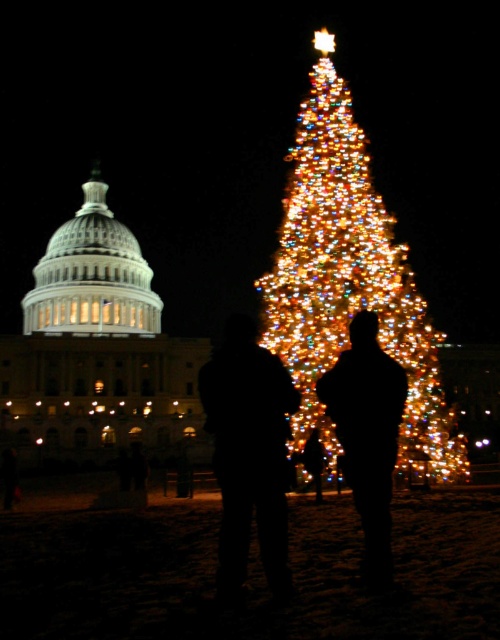
Question: Can you confirm if illuminated glass christmas tree at center is smaller than black silhouette couple at center?

Choices:
 (A) yes
 (B) no

Answer: (B)

Question: Which object is the closest to the black silhouette couple at center?

Choices:
 (A) black matte figure at center
 (B) illuminated glass christmas tree at center
 (C) black silhouette at center

Answer: (A)

Question: Is black silhouette couple at center below black silhouette at center?

Choices:
 (A) no
 (B) yes

Answer: (B)

Question: Is black silhouette couple at center to the right of black silhouette at center from the viewer's perspective?

Choices:
 (A) yes
 (B) no

Answer: (A)

Question: Which point is farther to the camera?

Choices:
 (A) (384, 509)
 (B) (322, 269)

Answer: (B)

Question: Which of these objects is positioned farthest from the illuminated glass christmas tree at center?

Choices:
 (A) black matte figure at center
 (B) black silhouette couple at center
 (C) black silhouette at center

Answer: (B)